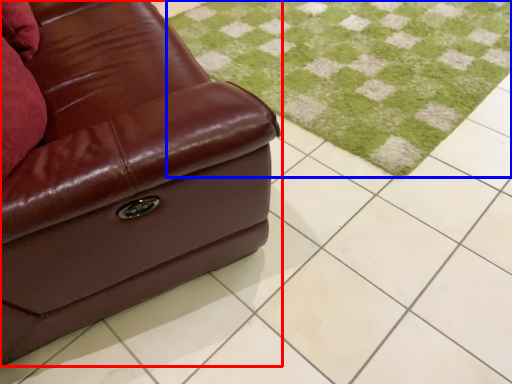
Question: Which object is further to the camera taking this photo, studio couch (highlighted by a red box) or grass (highlighted by a blue box)?

Choices:
 (A) studio couch
 (B) grass

Answer: (B)